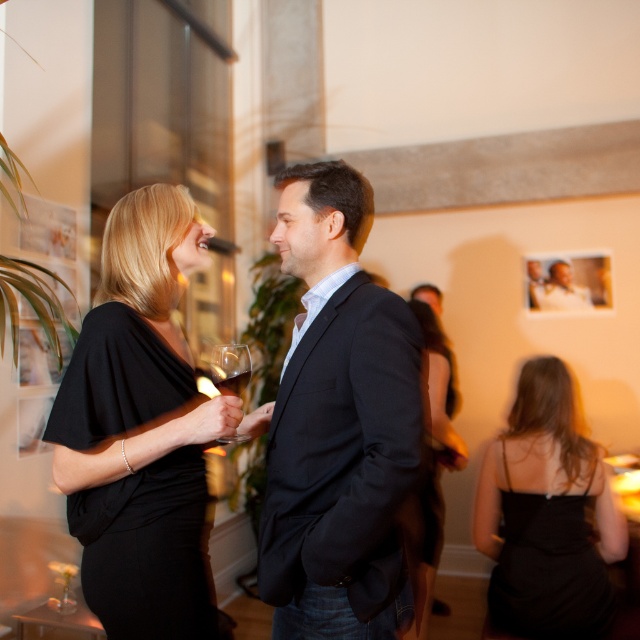
Looking at this image, is black matte suit at center to the right of black satin dress at left from the viewer's perspective?

Indeed, black matte suit at center is positioned on the right side of black satin dress at left.

Does black matte suit at center appear on the left side of black satin dress at left?

Incorrect, black matte suit at center is not on the left side of black satin dress at left.

At what (x,y) coordinates should I click in order to perform the action: click on black matte suit at center. Please return your answer as a coordinate pair (x, y). Looking at the image, I should click on (339, 424).

Does black matte suit at center appear on the right side of translucent glass wine at center?

Yes, black matte suit at center is to the right of translucent glass wine at center.

Is black matte suit at center behind translucent glass wine at center?

No, black matte suit at center is in front of translucent glass wine at center.

What do you see at coordinates (339, 424) in the screenshot?
I see `black matte suit at center` at bounding box center [339, 424].

The height and width of the screenshot is (640, 640). I want to click on black matte suit at center, so click(x=339, y=424).

Can you confirm if black satin dress at center is positioned above transparent glass at center?

No, black satin dress at center is not above transparent glass at center.

Between point (422, 618) and point (234, 435), which one is positioned in front?

Point (234, 435) is more forward.

Where is `black satin dress at center`? black satin dress at center is located at coordinates (435, 458).